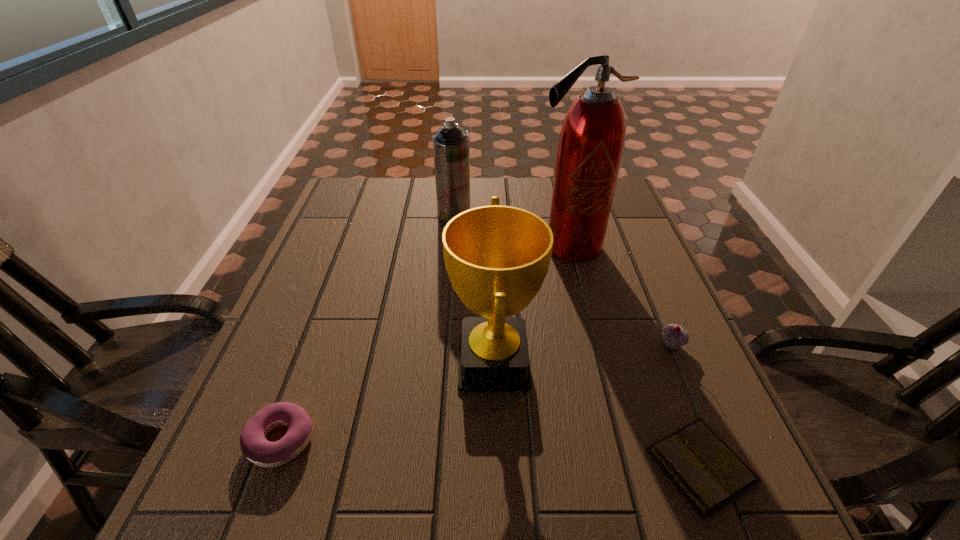
The image size is (960, 540). I want to click on cupcake present at the right edge, so click(674, 336).

Identify the location of diary at the right edge. The image size is (960, 540). (705, 469).

The image size is (960, 540). In order to click on object located in the near right corner section of the desktop in this screenshot , I will do `click(705, 469)`.

Image resolution: width=960 pixels, height=540 pixels. Identify the location of vacant space at the far edge. (395, 180).

The height and width of the screenshot is (540, 960). I want to click on vacant space at the near edge of the desktop, so click(315, 526).

You are a GUI agent. You are given a task and a screenshot of the screen. Output one action in this format:
    pyautogui.click(x=<x>, y=<y>)
    Task: Click on the vacant region at the left edge
    The image size is (960, 540).
    Given the screenshot: What is the action you would take?
    pyautogui.click(x=227, y=425)

The image size is (960, 540). I want to click on free space at the right edge of the desktop, so click(x=664, y=369).

Find the location of a particular element. vacant region between the tallest object and the shortest object is located at coordinates (636, 356).

Identify the location of free space between the shortest object and the fire extinguisher. The height and width of the screenshot is (540, 960). (636, 356).

Where is `free space between the award and the tallest object`? free space between the award and the tallest object is located at coordinates (532, 304).